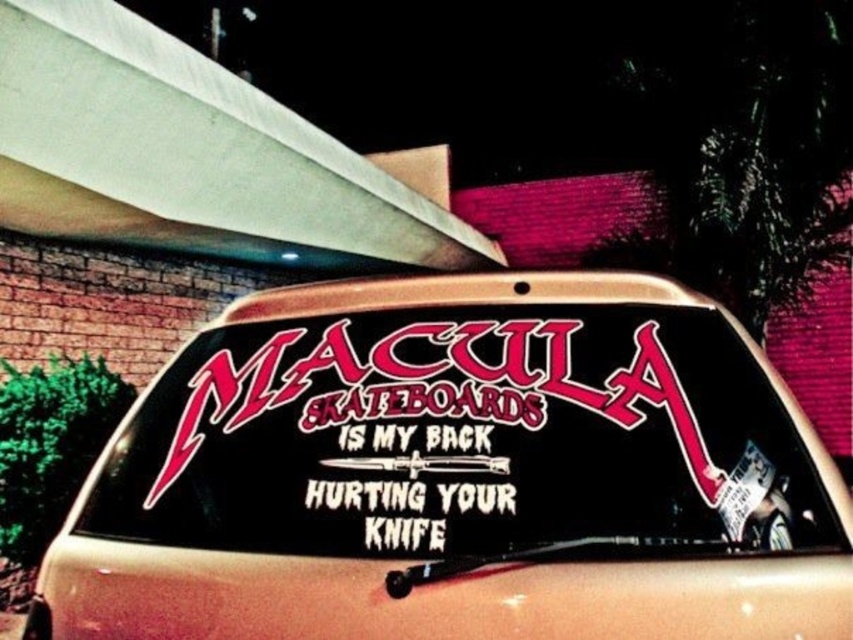
Is white vinyl text at center positioned in front of white paper sticker at lower right?

No, it is not.

Is point (369, 515) closer to camera compared to point (781, 541)?

No, (369, 515) is further to viewer.

This screenshot has height=640, width=853. In order to click on white vinyl text at center in this screenshot , I will do `click(415, 481)`.

Who is positioned more to the right, black matte sticker at center or white vinyl text at center?

From the viewer's perspective, black matte sticker at center appears more on the right side.

What do you see at coordinates (453, 474) in the screenshot? This screenshot has height=640, width=853. I see `black matte sticker at center` at bounding box center [453, 474].

Is point (718, 364) positioned after point (482, 460)?

That is True.

Where is `black matte sticker at center`? Image resolution: width=853 pixels, height=640 pixels. black matte sticker at center is located at coordinates (453, 474).

Is black matte sticker at center taller than white paper sticker at lower right?

Indeed, black matte sticker at center has a greater height compared to white paper sticker at lower right.

Is black matte sticker at center thinner than white paper sticker at lower right?

In fact, black matte sticker at center might be wider than white paper sticker at lower right.

Does point (175, 355) lie behind point (764, 515)?

Yes, point (175, 355) is farther from viewer.

The image size is (853, 640). I want to click on black matte sticker at center, so click(x=453, y=474).